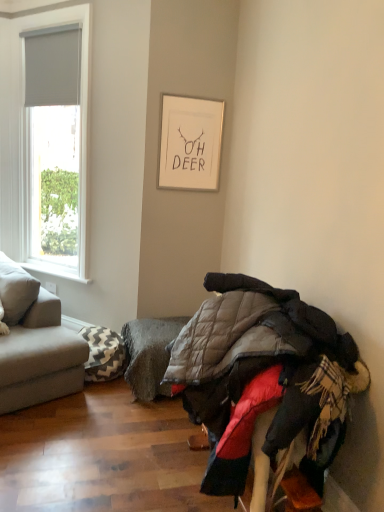
The image size is (384, 512). I want to click on vacant region in front of chevron-patterned fabric pillow at lower left, so click(x=97, y=399).